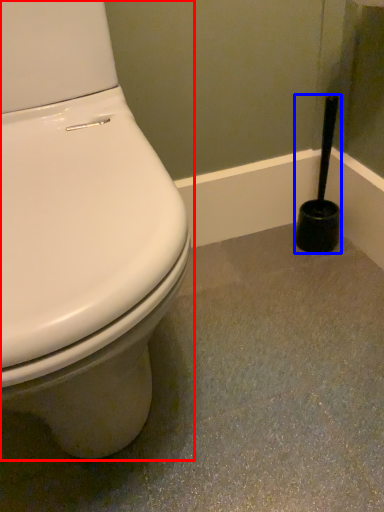
Question: Among these objects, which one is farthest to the camera, toilet (highlighted by a red box) or brush (highlighted by a blue box)?

Choices:
 (A) toilet
 (B) brush

Answer: (B)